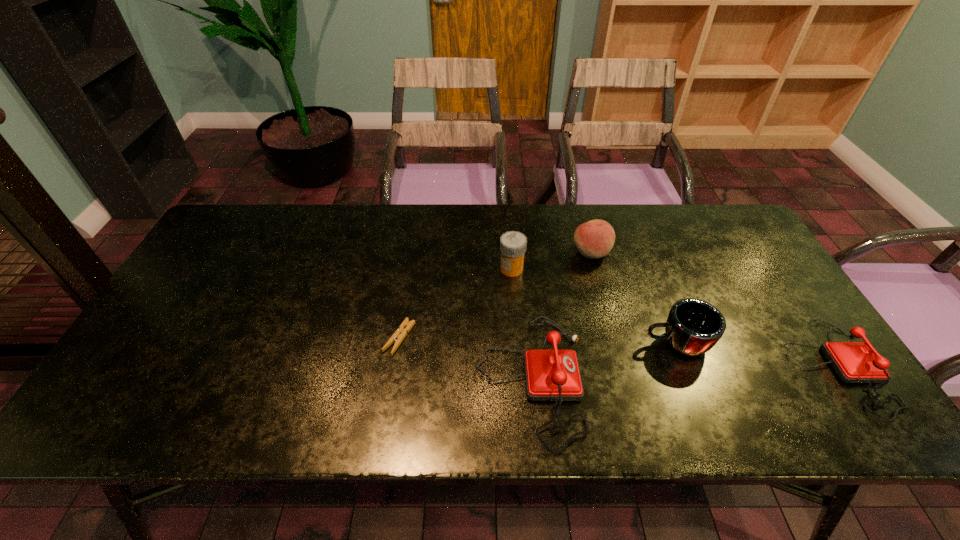
In the current image, all telephones are evenly spaced. To maintain this equal spacing, where should an additional telephone be placed on the left? Please point out a free spot. Please provide its 2D coordinates. Your answer should be formatted as a tuple, i.e. [(x, y)], where the tuple contains the x and y coordinates of a point satisfying the conditions above.

[(212, 393)]